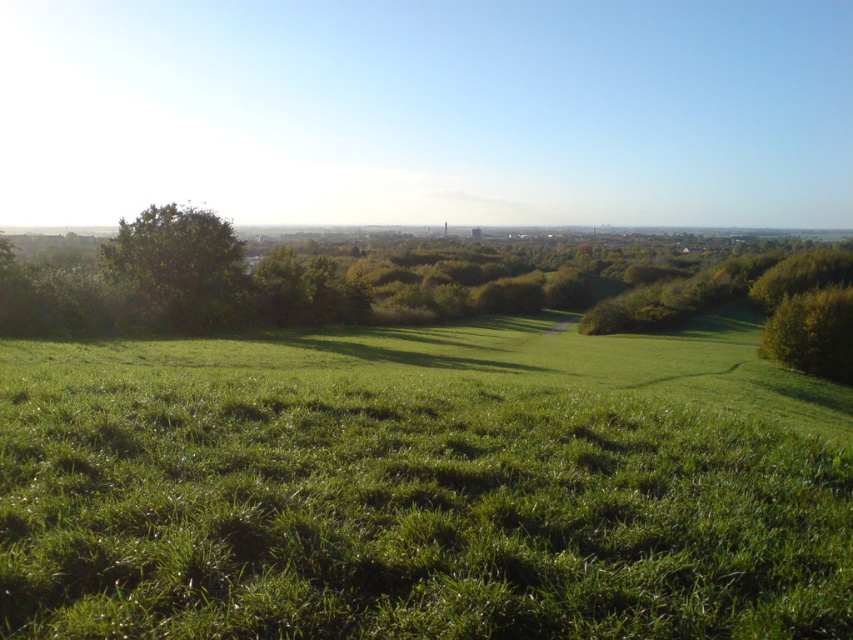
Does green grassy field at center have a larger size compared to green leafy tree at right?

Indeed, green grassy field at center has a larger size compared to green leafy tree at right.

Who is positioned more to the left, green grassy field at center or green leafy tree at right?

Positioned to the left is green grassy field at center.

The height and width of the screenshot is (640, 853). Describe the element at coordinates (422, 486) in the screenshot. I see `green grassy field at center` at that location.

Where is `green grassy field at center`? This screenshot has width=853, height=640. green grassy field at center is located at coordinates (422, 486).

Is green leafy tree at left to the left of green leafy tree at right from the viewer's perspective?

Indeed, green leafy tree at left is positioned on the left side of green leafy tree at right.

Which is more to the left, green leafy tree at left or green leafy tree at right?

green leafy tree at left

The height and width of the screenshot is (640, 853). I want to click on green leafy tree at left, so click(181, 266).

Find the location of `green leafy tree at left`. green leafy tree at left is located at coordinates (181, 266).

Consider the image. Can you confirm if green grassy field at center is thinner than green leafy tree at left?

No.

Who is taller, green grassy field at center or green leafy tree at left?

Standing taller between the two is green leafy tree at left.

Is point (12, 580) more distant than point (187, 291)?

No, it is in front of (187, 291).

Identify the location of green grassy field at center. Image resolution: width=853 pixels, height=640 pixels. (422, 486).